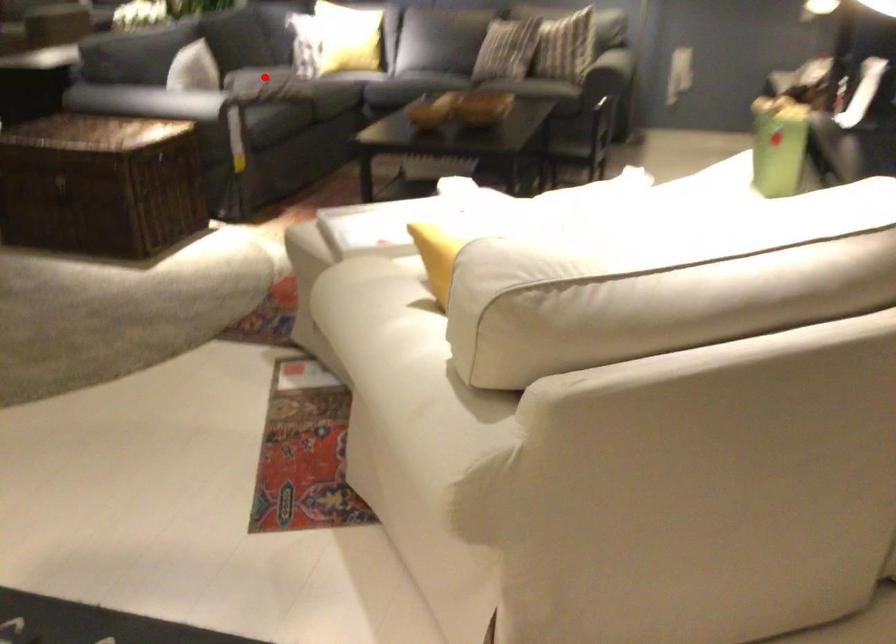
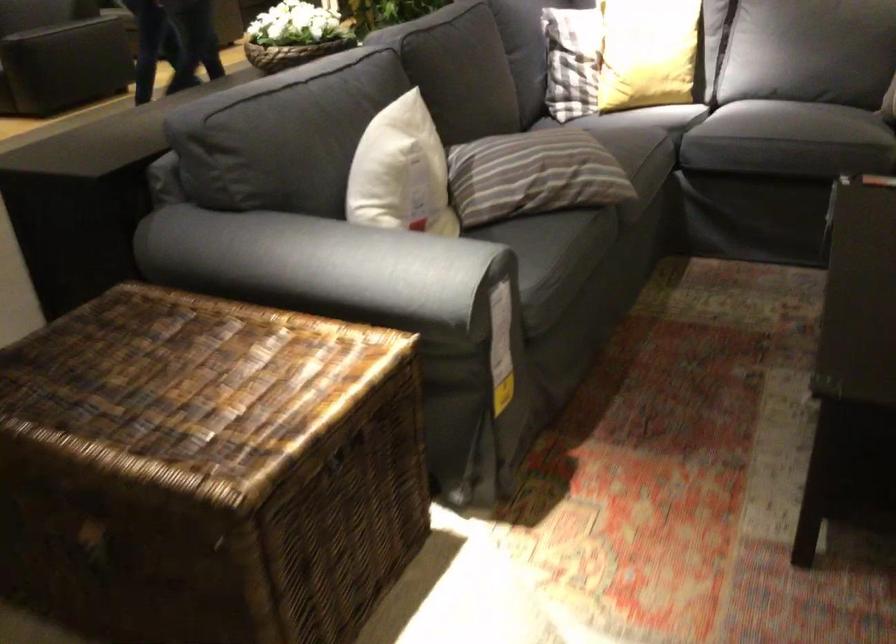
In the second image, find the point that corresponds to the highlighted location in the first image.

(533, 174)